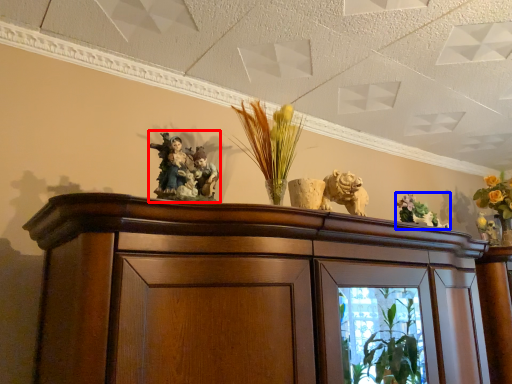
Question: Which point is closer to the camera, collection (highlighted by a red box) or floral arrangement (highlighted by a blue box)?

Choices:
 (A) collection
 (B) floral arrangement

Answer: (A)